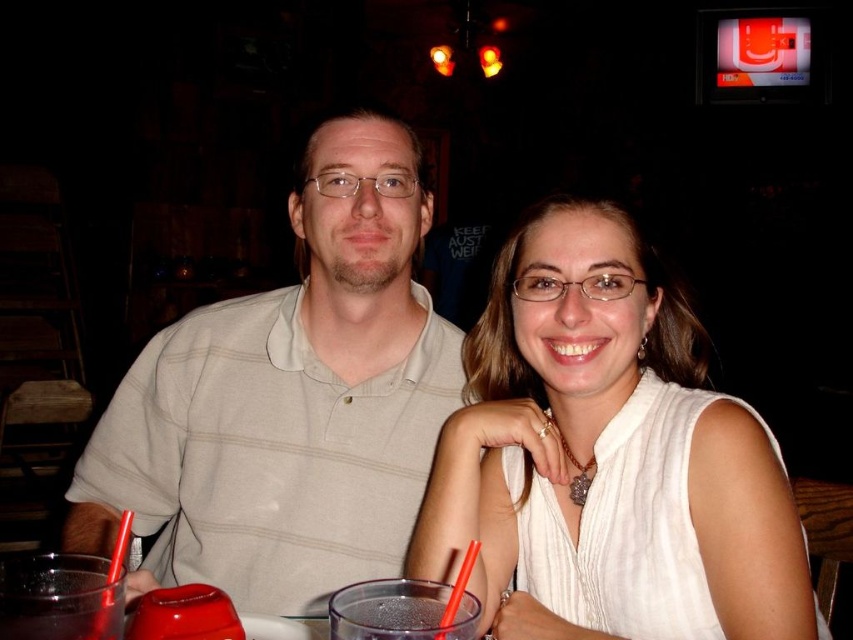
You are taking a photo of two people sitting at a table in a dimly lit restaurant. You want to focus on the person closer to the camera. Which point should you focus on, point (676, 544) or point (303, 480)?

Point (676, 544) is closer to the camera than point (303, 480), so you should focus on point (676, 544) to capture the person closer to the camera.

You are a waiter in a restaurant. You need to place a 12 inch long menu between the white silk blouse at center and the light beige striped polo shirt at center. Can you fit it there?

The distance between the white silk blouse at center and the light beige striped polo shirt at center is 10.50 inches. Since the menu is 12 inches long, it is longer than the available space, so the menu cannot be placed there without overlapping either item.

You are a fashion designer observing the two individuals at the table. Which clothing item, the white silk blouse at center or the light beige striped polo shirt at center, has a shorter length?

The white silk blouse at center is shorter than the light beige striped polo shirt at center.